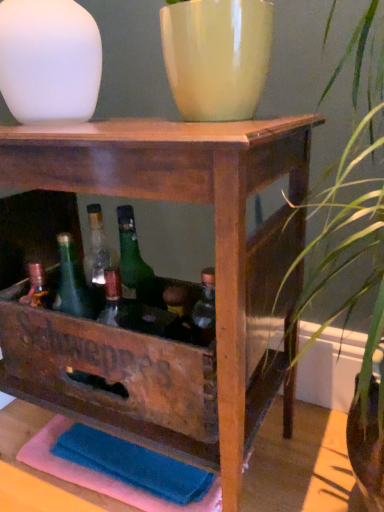
Where is `wooden crate at center`? The width and height of the screenshot is (384, 512). wooden crate at center is located at coordinates (215, 271).

This screenshot has height=512, width=384. What do you see at coordinates (178, 312) in the screenshot?
I see `matte green glass bottle at center` at bounding box center [178, 312].

You are a GUI agent. You are given a task and a screenshot of the screen. Output one action in this format:
    pyautogui.click(x=<x>, y=<y>)
    Task: Click on the matte yellow vase at upper center
    The height and width of the screenshot is (512, 384).
    Given the screenshot: What is the action you would take?
    pyautogui.click(x=217, y=56)

Which of these two, white matte vase at upper left or wooden crate at center, is smaller?

white matte vase at upper left.

Which object is positioned more to the left, white matte vase at upper left or wooden crate at center?

Positioned to the left is white matte vase at upper left.

From the image's perspective, is white matte vase at upper left on top of wooden crate at center?

Yes, from the image's perspective, white matte vase at upper left is over wooden crate at center.

Does matte yellow vase at upper center contain white matte vase at upper left?

No, white matte vase at upper left is located outside of matte yellow vase at upper center.

Considering their positions, is matte yellow vase at upper center located in front of or behind white matte vase at upper left?

Visually, matte yellow vase at upper center is located in front of white matte vase at upper left.

How far apart are matte yellow vase at upper center and white matte vase at upper left?

9.17 inches.

Considering the points (211, 106) and (40, 2), which point is behind, point (211, 106) or point (40, 2)?

Point (40, 2)

Does wooden crate at center have a lesser height compared to white matte vase at upper left?

No.

Looking at this image, is wooden crate at center positioned far away from white matte vase at upper left?

That's not correct — wooden crate at center is a little close to white matte vase at upper left.

Is point (262, 152) closer or farther from the camera than point (97, 71)?

Point (262, 152) is positioned closer to the camera compared to point (97, 71).

The image size is (384, 512). Identify the location of table on the left side of matte green glass bottle at center. (215, 271).

Looking at this image, does wooden crate at center have a greater height compared to matte green glass bottle at center?

Yes.

Is wooden crate at center surrounding matte green glass bottle at center?

Yes.

Which of these two, matte green glass bottle at center or wooden crate at center, is bigger?

wooden crate at center.

Does point (177, 314) lie in front of point (139, 374)?

No, it is behind (139, 374).

What's the angular difference between matte green glass bottle at center and wooden crate at center's facing directions?

0.345 degrees separate the facing orientations of matte green glass bottle at center and wooden crate at center.

From a real-world perspective, is matte green glass bottle at center physically located above or below wooden crate at center?

From a real-world perspective, matte green glass bottle at center is physically below wooden crate at center.

From the image's perspective, relative to white matte vase at upper left, is matte green glass bottle at center above or below?

Clearly, from the image's perspective, matte green glass bottle at center is below white matte vase at upper left.

Between matte green glass bottle at center and white matte vase at upper left, which one appears on the left side from the viewer's perspective?

Positioned to the left is white matte vase at upper left.

How different are the orientations of matte green glass bottle at center and white matte vase at upper left in degrees?

There is a 0.225-degree angle between the facing directions of matte green glass bottle at center and white matte vase at upper left.

The image size is (384, 512). Identify the location of vase lying above the matte green glass bottle at center (from the image's perspective). (49, 60).

Between point (185, 42) and point (167, 290), which one is positioned in front?

The point (185, 42) is in front.

Between matte yellow vase at upper center and matte green glass bottle at center, which one has smaller width?

matte green glass bottle at center is thinner.

From the image's perspective, is matte yellow vase at upper center located above or below matte green glass bottle at center?

From the image's perspective, matte yellow vase at upper center appears above matte green glass bottle at center.

From a real-world perspective, who is located higher, matte yellow vase at upper center or matte green glass bottle at center?

From a 3D spatial view, matte yellow vase at upper center is above.

Find the location of a particular element. vase on the left of wooden crate at center is located at coordinates (49, 60).

I want to click on flowerpot that is in front of the white matte vase at upper left, so click(217, 56).

From the image, which object appears to be farther from wooden crate at center, matte yellow vase at upper center or white matte vase at upper left?

The object further to wooden crate at center is white matte vase at upper left.

Looking at the image, which one is located closer to matte yellow vase at upper center, wooden crate at center or matte green glass bottle at center?

wooden crate at center is closer to matte yellow vase at upper center.

Looking at the image, which one is located further to wooden crate at center, matte green glass bottle at center or white matte vase at upper left?

Based on the image, white matte vase at upper left appears to be further to wooden crate at center.

When comparing their distances from matte green glass bottle at center, does matte yellow vase at upper center or white matte vase at upper left seem closer?

matte yellow vase at upper center is closer to matte green glass bottle at center.

Which object lies nearer to the anchor point matte yellow vase at upper center, matte green glass bottle at center or white matte vase at upper left?

white matte vase at upper left is closer to matte yellow vase at upper center.

Looking at the image, which one is located closer to white matte vase at upper left, matte yellow vase at upper center or wooden crate at center?

Based on the image, matte yellow vase at upper center appears to be nearer to white matte vase at upper left.

When comparing their distances from matte yellow vase at upper center, does wooden crate at center or white matte vase at upper left seem further?

wooden crate at center.

Looking at the image, which one is located further to white matte vase at upper left, matte green glass bottle at center or matte yellow vase at upper center?

matte green glass bottle at center is further to white matte vase at upper left.

Where is `table that lies between white matte vase at upper left and matte green glass bottle at center from top to bottom`? The width and height of the screenshot is (384, 512). table that lies between white matte vase at upper left and matte green glass bottle at center from top to bottom is located at coordinates (215, 271).

I want to click on flowerpot that lies between white matte vase at upper left and matte green glass bottle at center from top to bottom, so click(217, 56).

In order to click on table between matte yellow vase at upper center and matte green glass bottle at center from top to bottom in this screenshot , I will do `click(215, 271)`.

At what (x,y) coordinates should I click in order to perform the action: click on flowerpot between white matte vase at upper left and wooden crate at center in the vertical direction. Please return your answer as a coordinate pair (x, y). The width and height of the screenshot is (384, 512). Looking at the image, I should click on (217, 56).